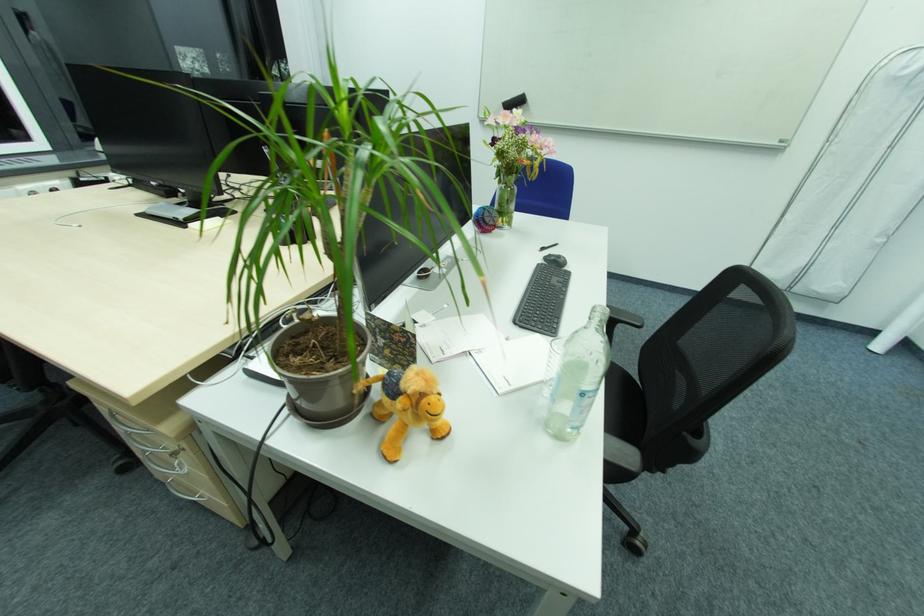
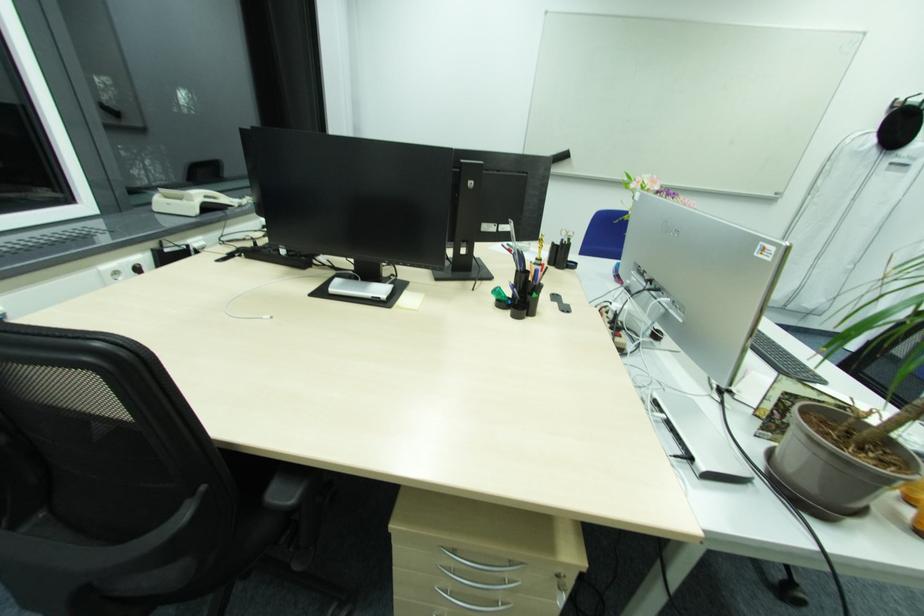
In the second image, find the point that corresponds to [41,193] in the first image.

(120, 272)